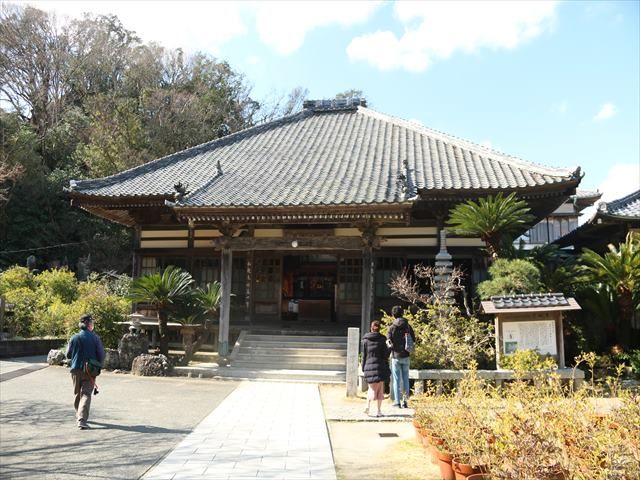
Locate an element on the screen. The width and height of the screenshot is (640, 480). columns is located at coordinates (368, 284), (223, 289).